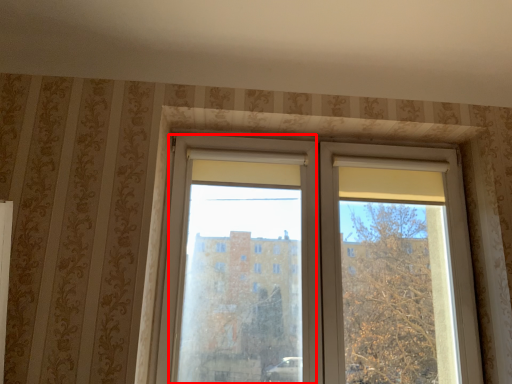
Question: From the image's perspective, where is screen door (annotated by the red box) located relative to window?

Choices:
 (A) below
 (B) above

Answer: (A)